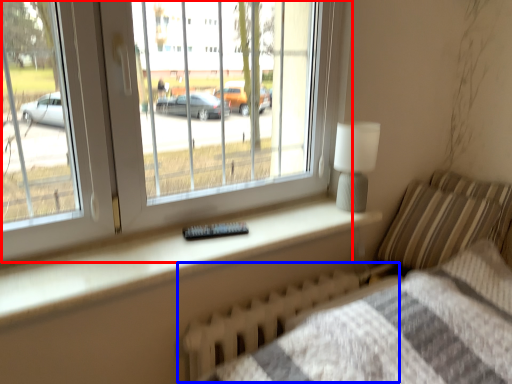
Question: Which point is further to the camera, window (highlighted by a red box) or radiator (highlighted by a blue box)?

Choices:
 (A) window
 (B) radiator

Answer: (B)